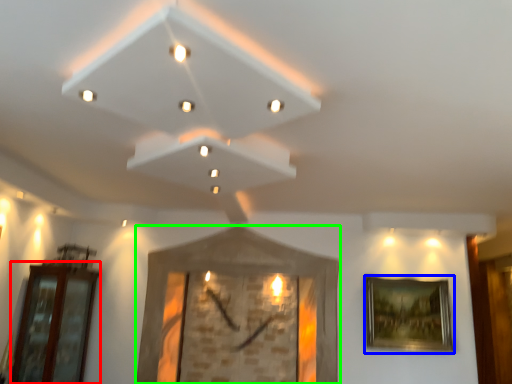
Question: Which is nearer to the glass door (highlighted by a red box)? picture frame (highlighted by a blue box) or picture frame (highlighted by a green box).

Choices:
 (A) picture frame
 (B) picture frame

Answer: (B)